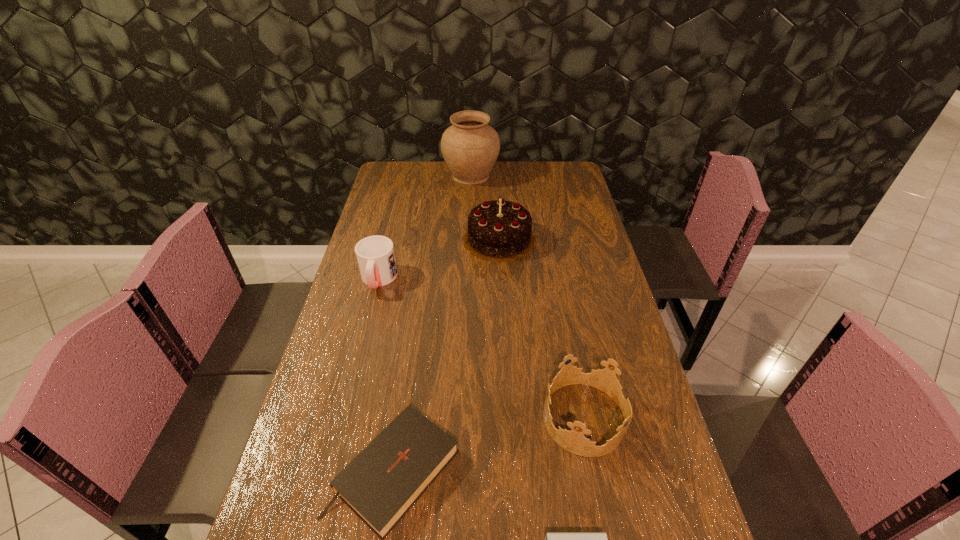
Where is `free location located 0.150m on the front-facing side of the tiara`? Image resolution: width=960 pixels, height=540 pixels. free location located 0.150m on the front-facing side of the tiara is located at coordinates (481, 418).

The width and height of the screenshot is (960, 540). What are the coordinates of `free space located on the side of the mug with the handle` in the screenshot? It's located at (354, 372).

Find the location of `object that is at the far edge`. object that is at the far edge is located at coordinates click(470, 147).

The height and width of the screenshot is (540, 960). Find the location of `object that is at the left edge`. object that is at the left edge is located at coordinates (375, 255).

Identify the location of object located at the right edge. The width and height of the screenshot is (960, 540). (574, 441).

Image resolution: width=960 pixels, height=540 pixels. I want to click on vacant space at the far edge of the desktop, so click(512, 174).

What are the coordinates of `vacant space at the left edge` in the screenshot? It's located at (390, 223).

In the image, there is a desktop. Identify the location of vacant space at the right edge. The image size is (960, 540). (572, 261).

The image size is (960, 540). In the image, there is a desktop. What are the coordinates of `vacant space at the far right corner` in the screenshot? It's located at (542, 186).

Find the location of a particular element. The image size is (960, 540). free space between the mug and the tiara is located at coordinates (482, 349).